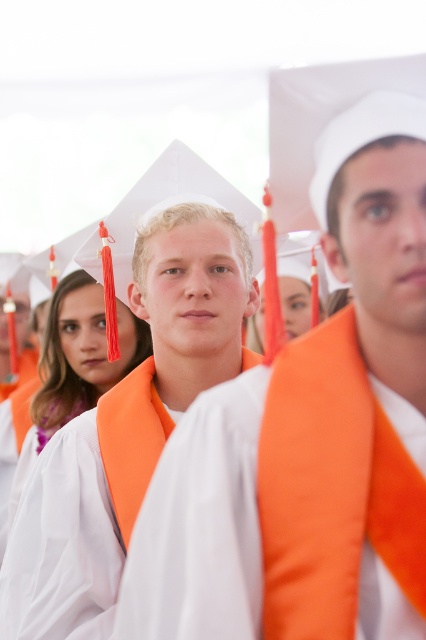
You are a photographer at a graduation ceremony. You need to adjust the lighting so that the matte orange graduation gown at center and the white matte graduation gown at center are both well lit. Which gown should you adjust the light towards first if the orange gown is to the right of the white one?

The matte orange graduation gown at center is to the right of the white matte graduation gown at center. Since the orange gown is positioned to the right, you should adjust the light towards the white gown first to ensure both are evenly illuminated.

You are a photographer at the graduation ceremony. You need to adjust the camera focus so that both the matte orange graduation gown at center and the white matte graduation gown at center are clearly visible. Which gown should you focus on first to ensure both are in focus?

The matte orange graduation gown at center is much taller than the white matte graduation gown at center, so you should focus on the matte orange graduation gown at center first to ensure both are in focus.